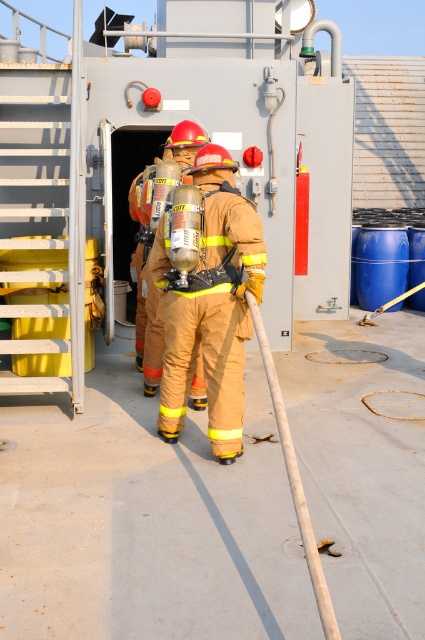
Can you confirm if brown/cotton fireman at center is positioned to the right of matte yellow fireman at center?

Yes, brown/cotton fireman at center is to the right of matte yellow fireman at center.

At what (x,y) coordinates should I click in order to perform the action: click on brown/cotton fireman at center. Please return your answer as a coordinate pair (x, y). Looking at the image, I should click on (210, 307).